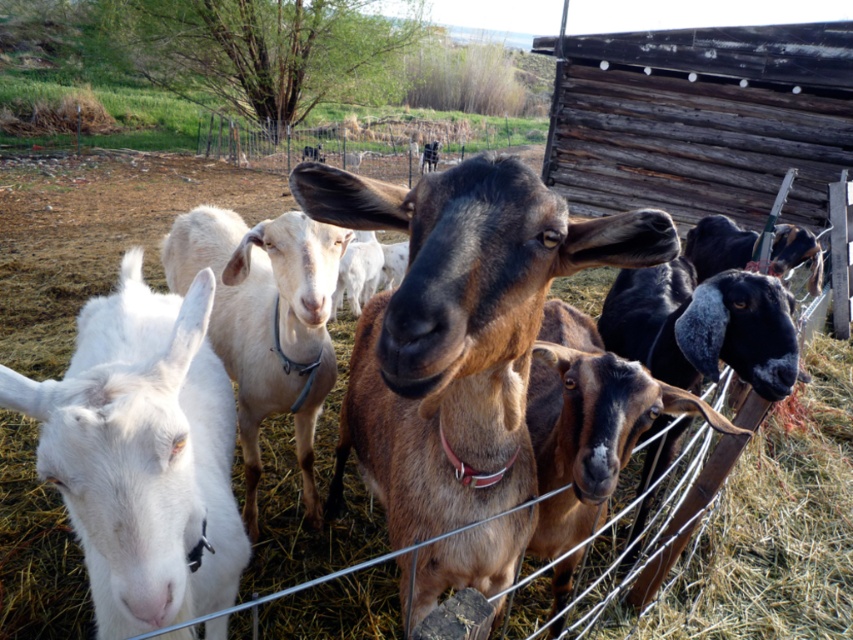
You are a farmer who wants to fit both the white woolen goat at center and the brown soft fur goat at center into a rectangular pen. The pen can only accommodate the wider of the two goats. Which goat should you prioritize placing first to ensure they both fit?

The white woolen goat at center is wider than the brown soft fur goat at center, so you should prioritize placing the white woolen goat at center first to ensure both fit in the pen.

You are a farmer checking on your goats. You notice two goats at the center of the scene. Which one is closer to you, the brown furry goat at center or the white woolen goat at center?

The brown furry goat at center is closer to you because it is in front of the white woolen goat at center.